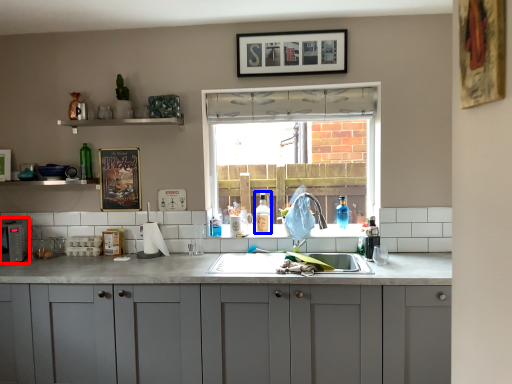
Question: Which of the following is the closest to the observer, appliance (highlighted by a red box) or bottle (highlighted by a blue box)?

Choices:
 (A) appliance
 (B) bottle

Answer: (A)